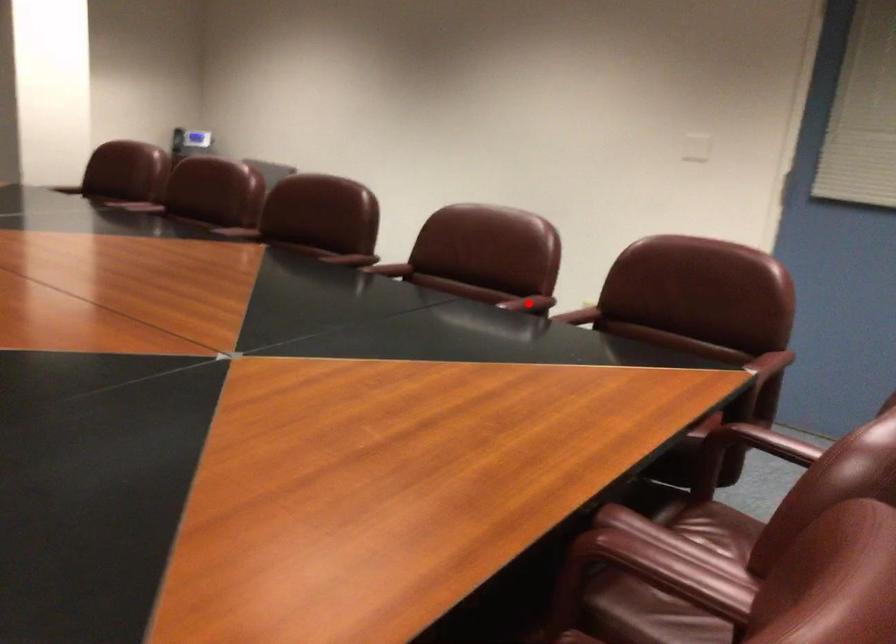
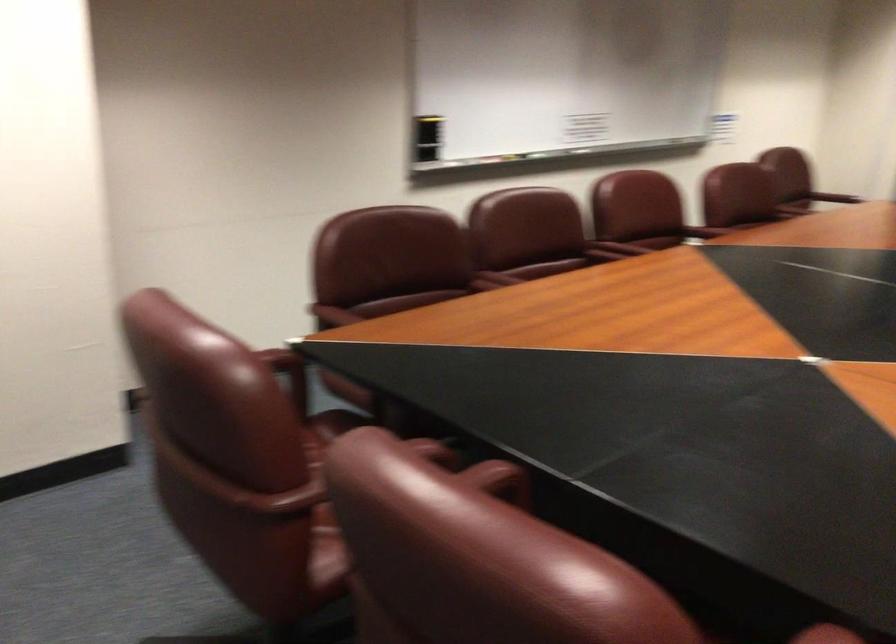
Question: I am providing you with two images of the same scene from different viewpoints. A red point is marked on the first image. Can you still see the location of the red point in image 2?

Choices:
 (A) Yes
 (B) No

Answer: (B)